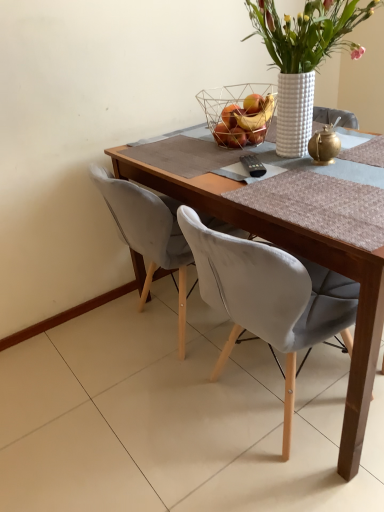
Question: Is point (314, 158) closer or farther from the camera than point (178, 233)?

Choices:
 (A) farther
 (B) closer

Answer: (B)

Question: From the image's perspective, is gold metallic teapot at upper right positioned above or below velvet grey chair at center?

Choices:
 (A) above
 (B) below

Answer: (A)

Question: Which is nearer to the white textured vase at upper center?

Choices:
 (A) gold metallic teapot at upper right
 (B) wooden table at center
 (C) velvet grey chair at center
 (D) wire mesh basket at upper center

Answer: (A)

Question: Considering the real-world distances, which object is farthest from the wooden table at center?

Choices:
 (A) wire mesh basket at upper center
 (B) gold metallic teapot at upper right
 (C) white textured vase at upper center
 (D) velvet grey chair at center

Answer: (C)